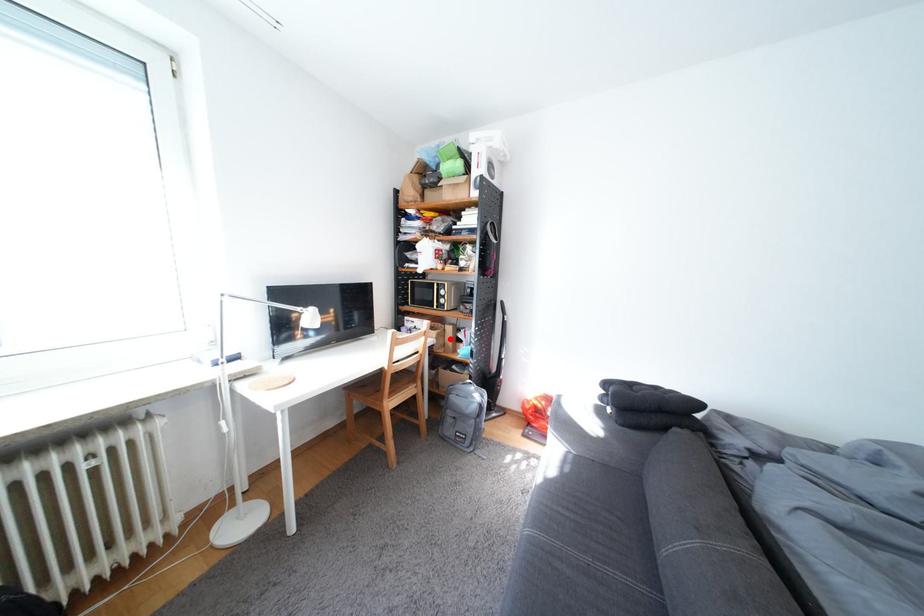
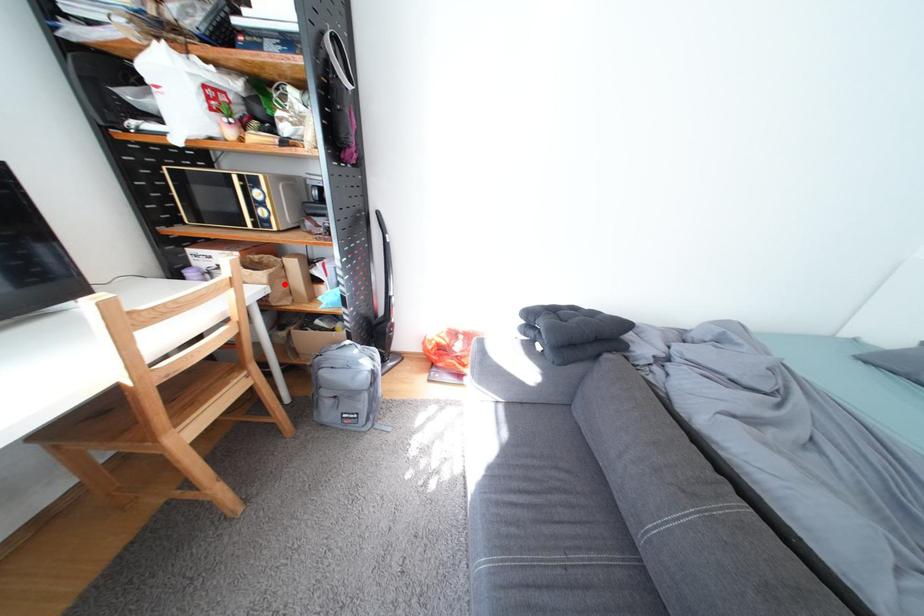
I am providing you with two images of the same scene from different viewpoints. A red point is marked on the first image and another point is marked on the second image. Are the points marked in image1 and image2 representing the same 3D position?

Yes